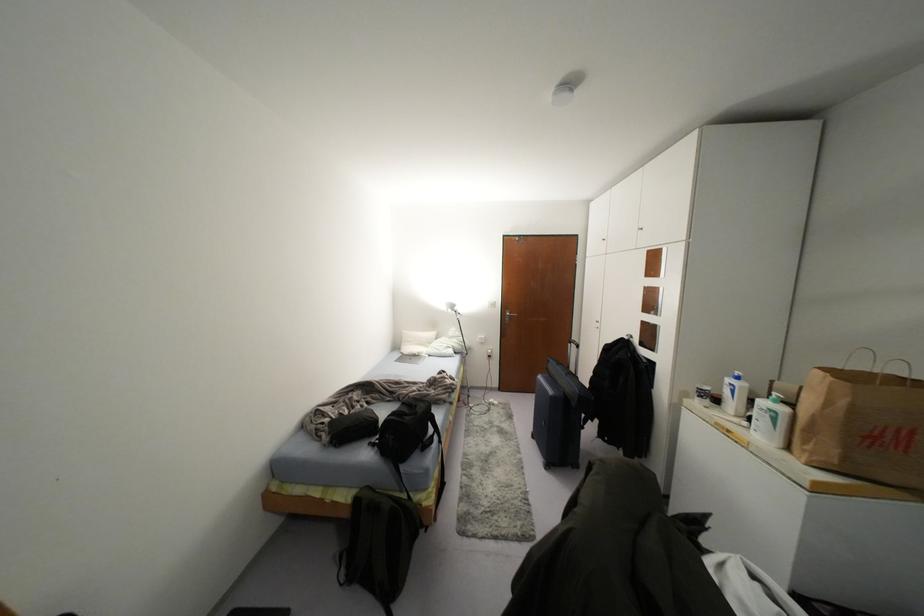
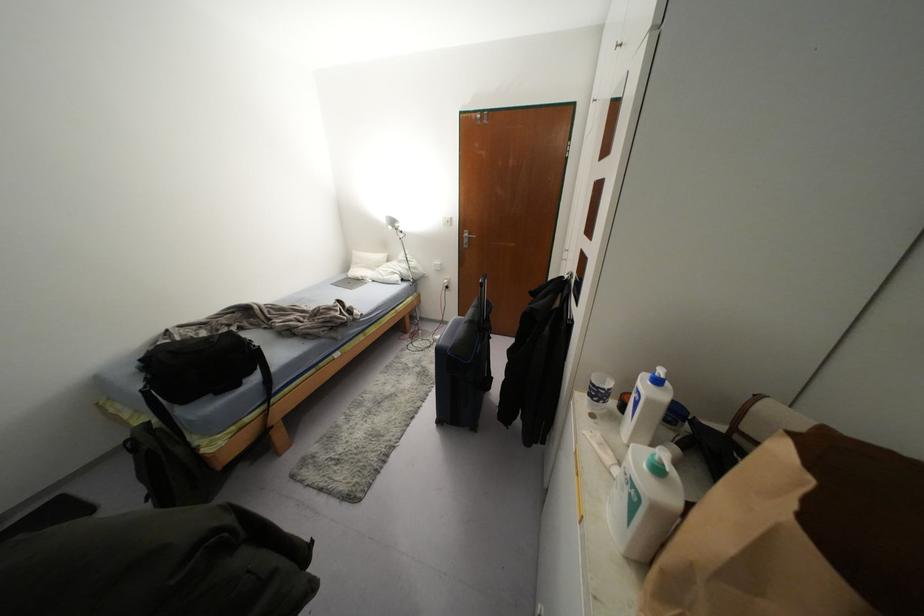
Locate, in the second image, the point that corresponds to pixel 736 378 in the first image.

(658, 381)